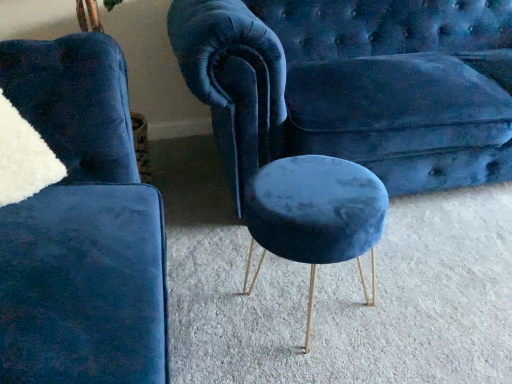
The width and height of the screenshot is (512, 384). What are the coordinates of `vacant space underneath velvet blue stool at center (from a real-world perspective)` in the screenshot? It's located at (303, 295).